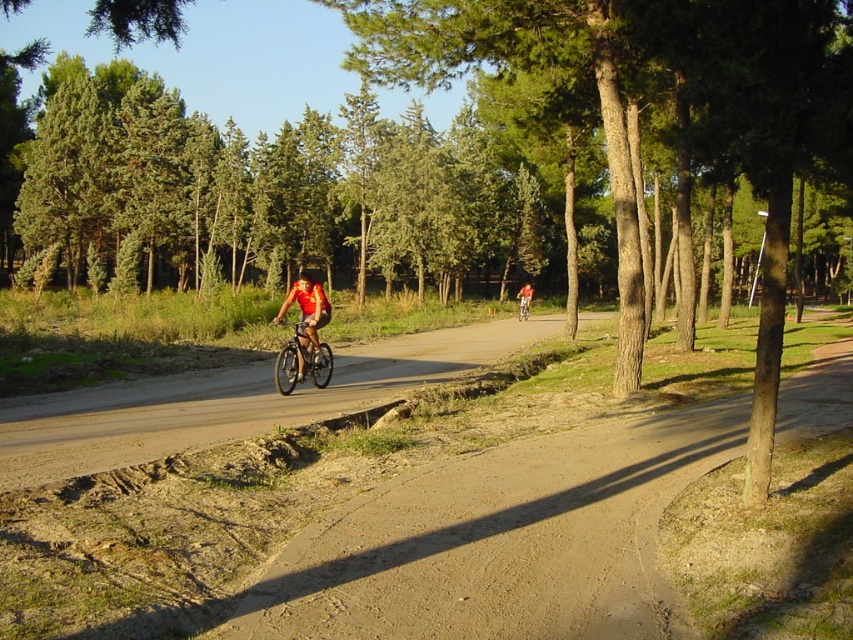
From the picture: How distant is matte black bicycle at center from black matte bicycle helmet at center?

matte black bicycle at center and black matte bicycle helmet at center are 50.48 feet apart.

Which is more to the right, matte black bicycle at center or black matte bicycle helmet at center?

From the viewer's perspective, matte black bicycle at center appears more on the right side.

Is point (529, 296) closer to camera compared to point (309, 275)?

No, (529, 296) is further to viewer.

Locate an element on the screen. matte black bicycle at center is located at coordinates (523, 305).